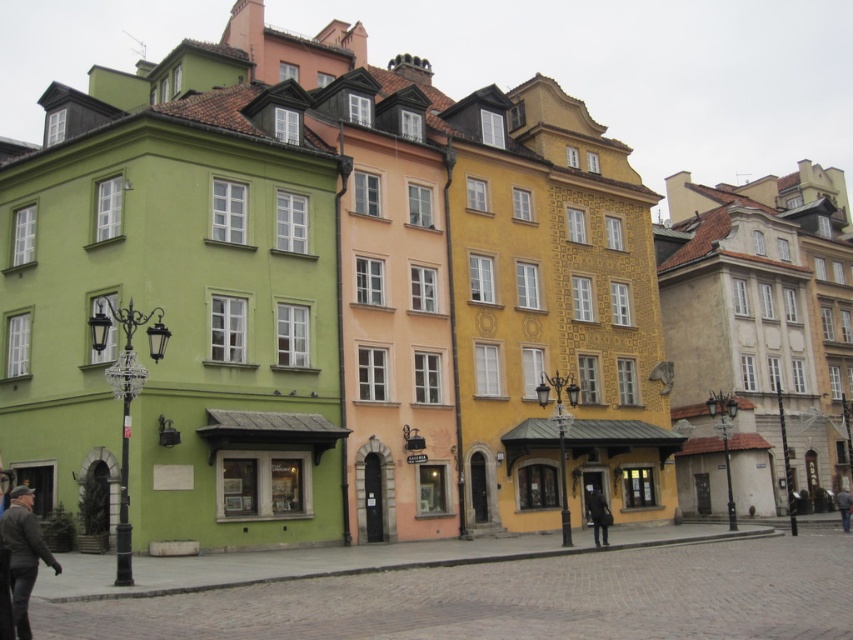
Who is shorter, dark gray leather jacket at lower left or dark gray fabric jacket at lower right?

dark gray fabric jacket at lower right is shorter.

Does dark gray leather jacket at lower left have a smaller size compared to dark gray fabric jacket at lower right?

Incorrect, dark gray leather jacket at lower left is not smaller in size than dark gray fabric jacket at lower right.

Is point (32, 545) farther from viewer compared to point (846, 518)?

That is False.

Find the location of a particular element. Image resolution: width=853 pixels, height=640 pixels. dark gray leather jacket at lower left is located at coordinates (22, 554).

Which of these two, dark gray fabric coat at center or dark gray fabric jacket at lower right, stands shorter?

Standing shorter between the two is dark gray fabric coat at center.

Does dark gray fabric coat at center appear over dark gray fabric jacket at lower right?

Indeed, dark gray fabric coat at center is positioned over dark gray fabric jacket at lower right.

Locate an element on the screen. This screenshot has width=853, height=640. dark gray fabric coat at center is located at coordinates (598, 515).

Where is `dark gray fabric coat at center`? Image resolution: width=853 pixels, height=640 pixels. dark gray fabric coat at center is located at coordinates (598, 515).

Is dark gray leather jacket at lower left positioned at the back of dark gray fabric coat at center?

No, dark gray leather jacket at lower left is closer to the viewer.

Who is positioned more to the right, dark gray leather jacket at lower left or dark gray fabric coat at center?

Positioned to the right is dark gray fabric coat at center.

Is point (25, 554) positioned behind point (593, 502)?

No.

Locate an element on the screen. This screenshot has height=640, width=853. dark gray leather jacket at lower left is located at coordinates (22, 554).